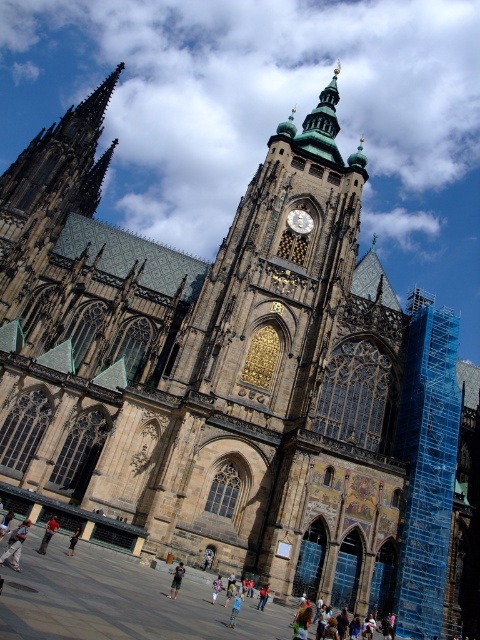
Is light brown leather pants at lower left below blue denim jeans at lower center?

No, light brown leather pants at lower left is not below blue denim jeans at lower center.

Does point (6, 552) lie in front of point (236, 605)?

Yes, point (6, 552) is in front of point (236, 605).

Is point (3, 561) positioned before point (240, 595)?

Yes, it is.

At what (x,y) coordinates should I click in order to perform the action: click on light brown leather pants at lower left. Please return your answer as a coordinate pair (x, y). The image size is (480, 640). Looking at the image, I should click on (15, 545).

From the picture: Is light brown leather pants at lower left positioned before dark blue jeans at lower center?

Yes, light brown leather pants at lower left is closer to the viewer.

This screenshot has height=640, width=480. Describe the element at coordinates (15, 545) in the screenshot. I see `light brown leather pants at lower left` at that location.

The height and width of the screenshot is (640, 480). Identify the location of light brown leather pants at lower left. (15, 545).

Can you confirm if dark gray fabric pants at lower center is positioned to the left of dark blue jeans at lower center?

In fact, dark gray fabric pants at lower center is to the right of dark blue jeans at lower center.

Does dark gray fabric pants at lower center have a larger size compared to dark blue jeans at lower center?

Yes, dark gray fabric pants at lower center is bigger than dark blue jeans at lower center.

The height and width of the screenshot is (640, 480). What do you see at coordinates (177, 579) in the screenshot? I see `dark gray fabric pants at lower center` at bounding box center [177, 579].

Locate an element on the screen. Image resolution: width=480 pixels, height=640 pixels. dark gray fabric pants at lower center is located at coordinates (177, 579).